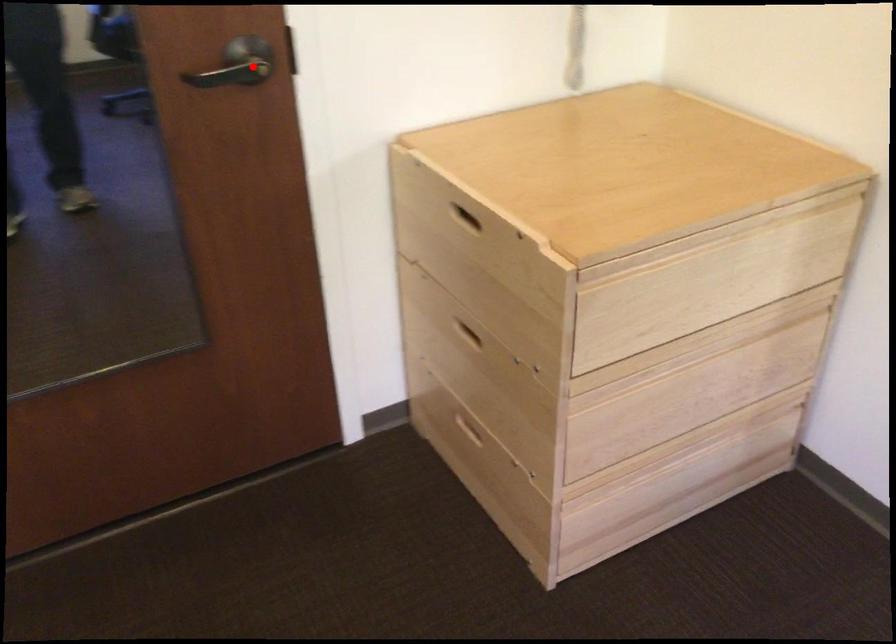
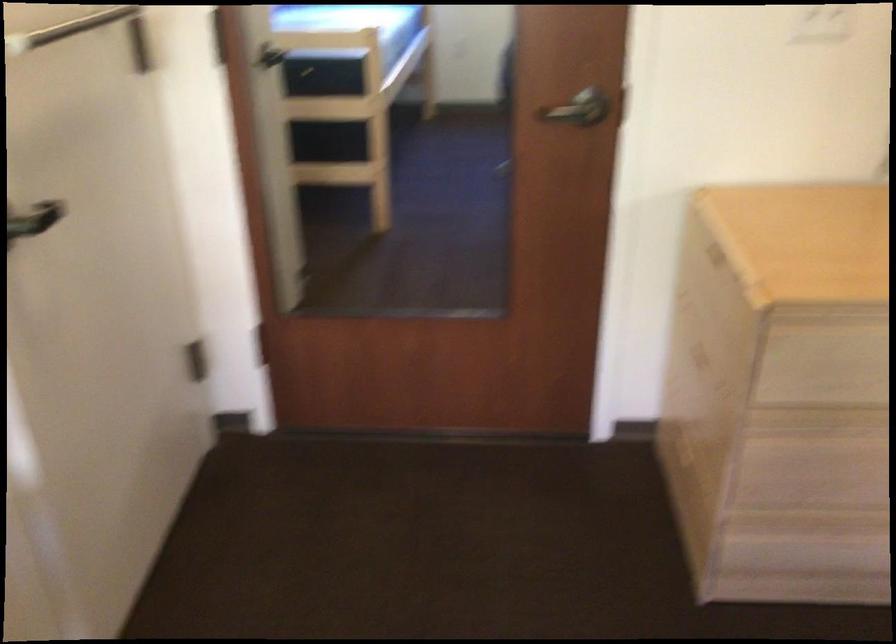
Question: I am providing you with two images of the same scene from different viewpoints. A red point is shown in image1. For the corresponding object point in image2, is it positioned nearer or farther from the camera?

Choices:
 (A) Nearer
 (B) Farther

Answer: (B)